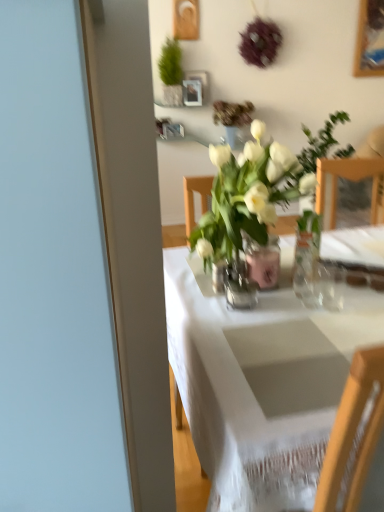
What are the coordinates of `vacant space positioned to the left of pink glass vase at center, the second vase from the front` in the screenshot? It's located at (202, 283).